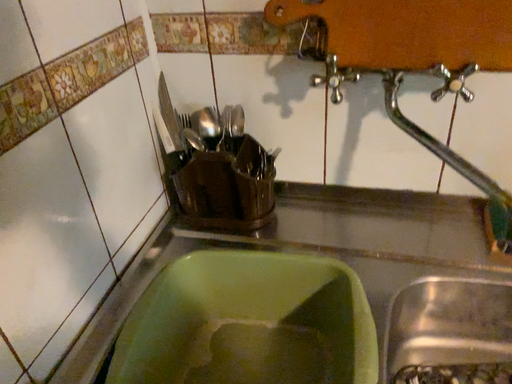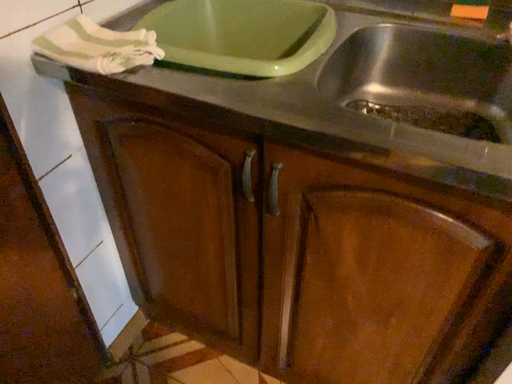
Question: Which way did the camera rotate in the video?

Choices:
 (A) rotated downward
 (B) rotated upward

Answer: (A)